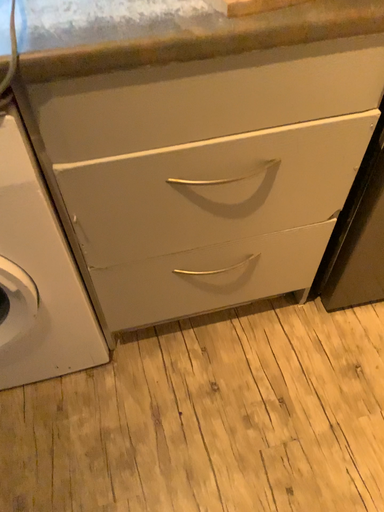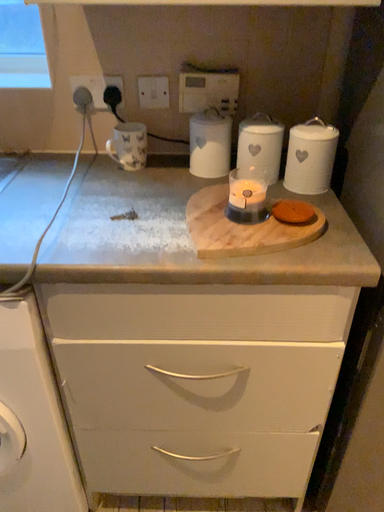
Question: Which way did the camera rotate in the video?

Choices:
 (A) rotated upward
 (B) rotated downward

Answer: (A)